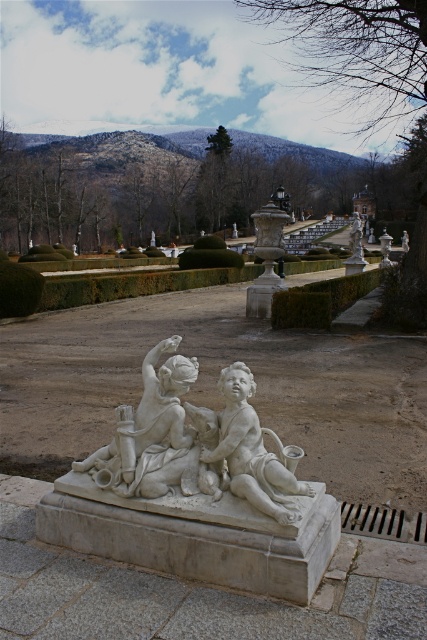
Measure the distance between white marble sculpture at center and white marble statue at upper right.

white marble sculpture at center is 21.94 meters from white marble statue at upper right.

Is white marble sculpture at center further to the viewer compared to white marble statue at upper right?

No, white marble sculpture at center is in front of white marble statue at upper right.

Which is in front, point (128, 422) or point (383, 243)?

Point (128, 422) is in front.

At what (x,y) coordinates should I click in order to perform the action: click on white marble sculpture at center. Please return your answer as a coordinate pair (x, y). Looking at the image, I should click on (193, 444).

Between white marble sculpture at center and white marble cherub at center, which one is positioned higher?

Positioned higher is white marble cherub at center.

Who is lower down, white marble sculpture at center or white marble cherub at center?

Positioned lower is white marble sculpture at center.

Between point (142, 490) and point (242, 449), which one is positioned behind?

The point (142, 490) is more distant.

Where is `white marble sculpture at center`? The width and height of the screenshot is (427, 640). white marble sculpture at center is located at coordinates (193, 444).

Between point (257, 422) and point (385, 250), which one is positioned behind?

Positioned behind is point (385, 250).

Is white marble cherub at center shorter than white marble statue at upper right?

Yes.

Which is in front, point (263, 490) or point (386, 243)?

Point (263, 490) is more forward.

You are a GUI agent. You are given a task and a screenshot of the screen. Output one action in this format:
    pyautogui.click(x=<x>, y=<y>)
    Task: Click on the white marble cherub at center
    Image resolution: width=427 pixels, height=640 pixels.
    Given the screenshot: What is the action you would take?
    pyautogui.click(x=251, y=451)